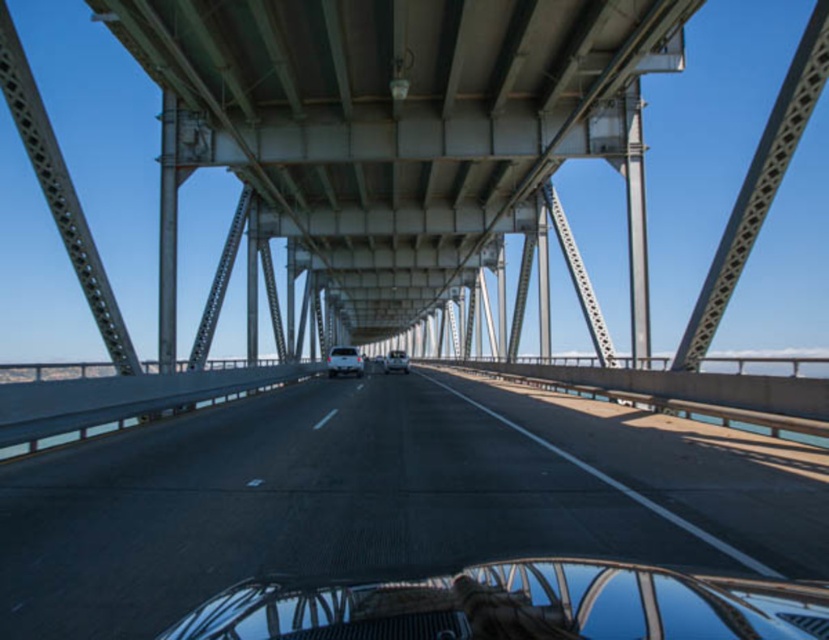
You are driving a car and see two points marked on the road ahead. The first point is at point (280, 600) and the second is at point (326, 362). Which point is closer to your current position?

Point (326, 362) is closer to your current position because it is behind point (280, 600), which is further ahead.

You are driving a car that is 15 feet long. You want to make sure your entire car fits on the smooth asphalt highway at center. Based on the distance provided, can your car fit on the highway?

The smooth asphalt highway at center is 12.21 feet away from the viewer. Since the car is 15 feet long, which is longer than the distance provided, the entire car cannot fit on the highway at this distance.